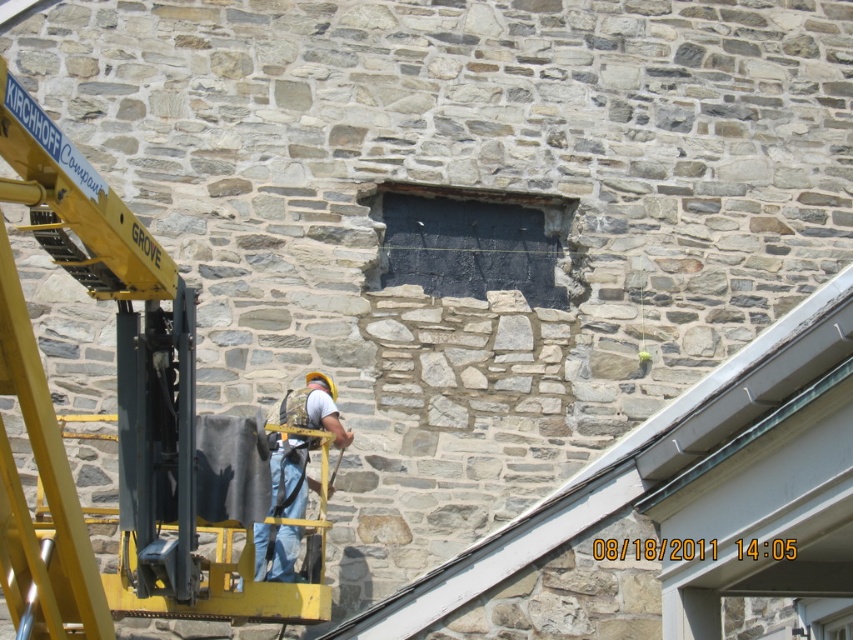
Question: Is yellow metal crane at left positioned behind black stone hole at center?

Choices:
 (A) yes
 (B) no

Answer: (B)

Question: Which point is farther to the camera?

Choices:
 (A) (486, 244)
 (B) (79, 536)

Answer: (A)

Question: Does yellow metal crane at left have a smaller size compared to denim jeans at center?

Choices:
 (A) no
 (B) yes

Answer: (A)

Question: Which of the following is the farthest from the observer?

Choices:
 (A) (520, 220)
 (B) (294, 445)
 (C) (33, 129)

Answer: (A)

Question: Which of the following is the closest to the observer?

Choices:
 (A) (207, 563)
 (B) (386, 272)

Answer: (A)

Question: Is yellow metal crane at left smaller than denim jeans at center?

Choices:
 (A) yes
 (B) no

Answer: (B)